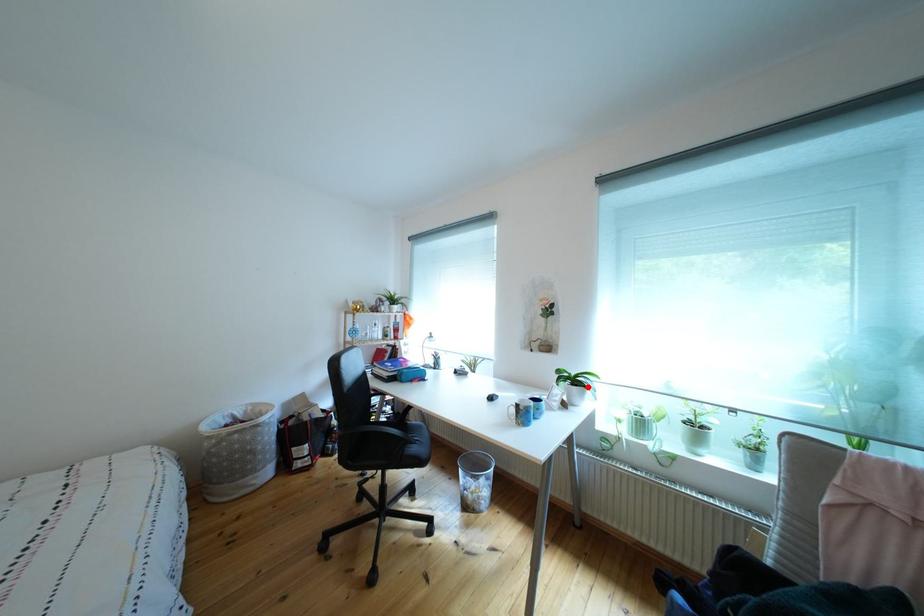
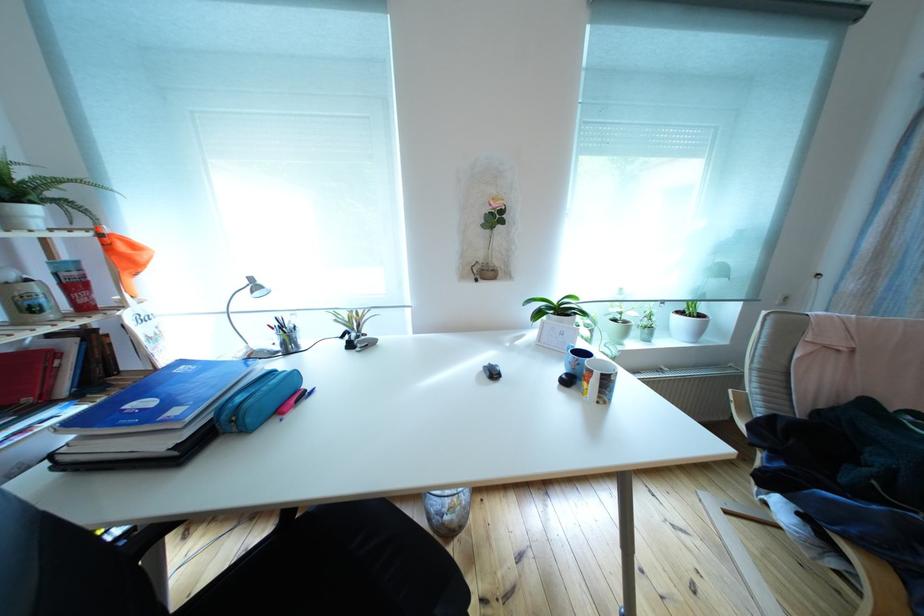
Find the pixel in the second image that matches the highlighted location in the first image.

(576, 315)